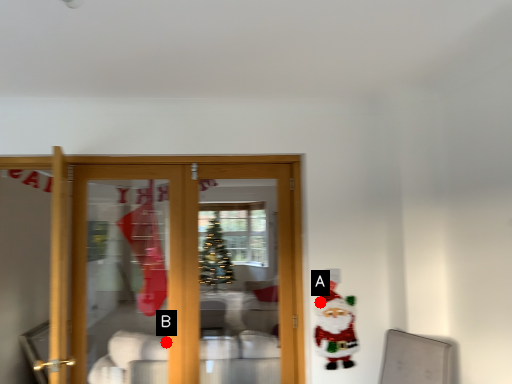
Question: Two points are circled on the image, labeled by A and B beside each circle. Which point appears farthest from the camera in this image?

Choices:
 (A) A is further
 (B) B is further

Answer: (B)